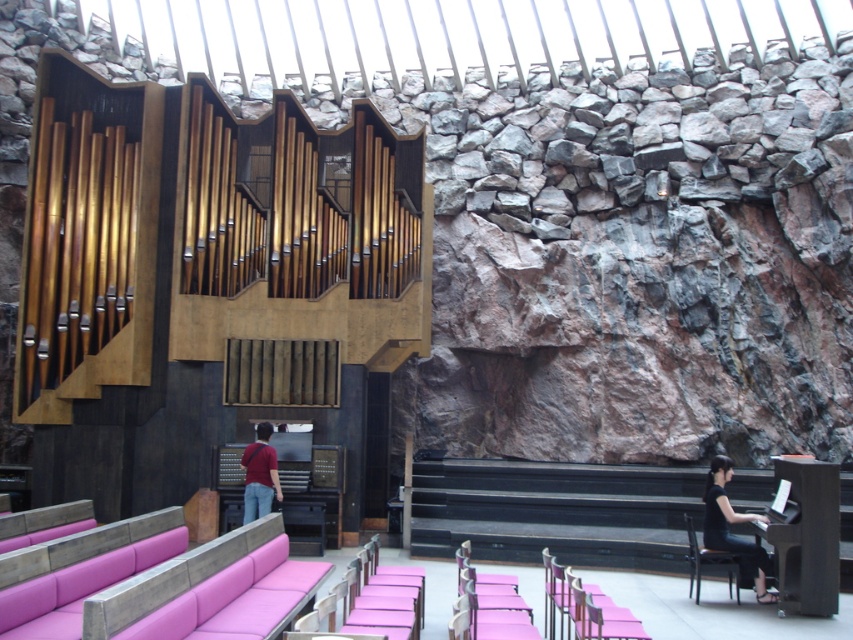
Is black fabric at lower right taller than matte red shirt at center?

Correct, black fabric at lower right is much taller as matte red shirt at center.

From the picture: Which of these two, black fabric at lower right or matte red shirt at center, stands shorter?

With less height is matte red shirt at center.

Is point (714, 460) behind point (265, 474)?

No.

Where is `black fabric at lower right`? The width and height of the screenshot is (853, 640). black fabric at lower right is located at coordinates (730, 532).